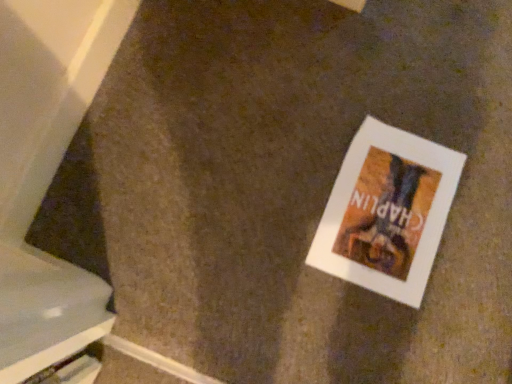
What are the coordinates of `empty space that is ontop of white paper at center (from a real-world perspective)` in the screenshot? It's located at (391, 223).